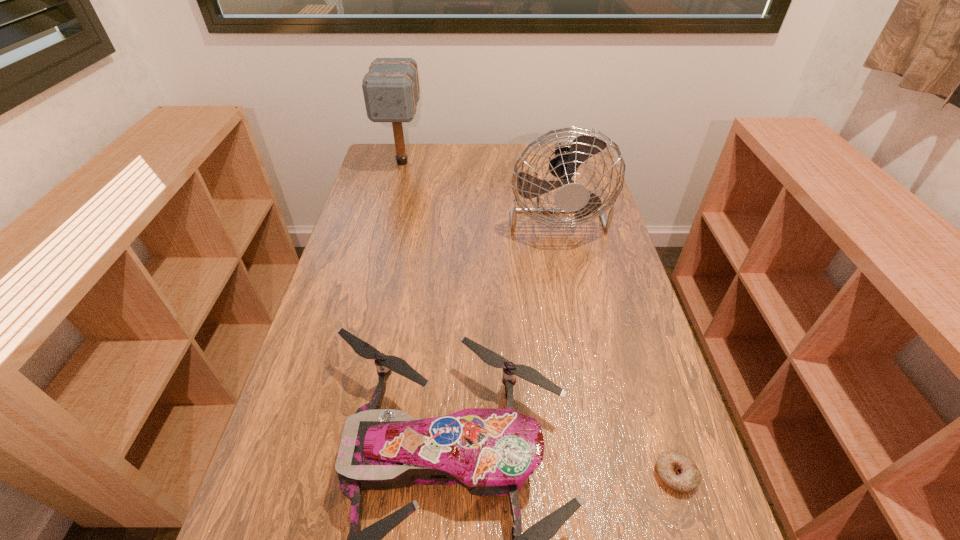
Locate an element on the screen. This screenshot has width=960, height=540. doughnut situated at the right edge is located at coordinates (676, 470).

At what (x,y) coordinates should I click in order to perform the action: click on object at the far left corner. Please return your answer as a coordinate pair (x, y). The height and width of the screenshot is (540, 960). Looking at the image, I should click on [x=391, y=91].

Identify the location of object located at the far right corner. The width and height of the screenshot is (960, 540). (572, 197).

Find the location of a particular element. The image size is (960, 540). vacant space at the far edge of the desktop is located at coordinates (473, 159).

I want to click on free space at the left edge of the desktop, so click(381, 245).

Where is `vacant region at the right edge of the desktop`? The height and width of the screenshot is (540, 960). vacant region at the right edge of the desktop is located at coordinates (609, 239).

In order to click on unoccupied area between the shortest object and the mallet in this screenshot , I will do `click(539, 319)`.

Where is `vacant area between the mallet and the shortest object`? This screenshot has height=540, width=960. vacant area between the mallet and the shortest object is located at coordinates (539, 319).

Find the location of a particular element. The image size is (960, 540). vacant area that lies between the fan and the mallet is located at coordinates (478, 185).

Identify the location of blank region between the fan and the shortest object. The image size is (960, 540). pyautogui.click(x=615, y=341).